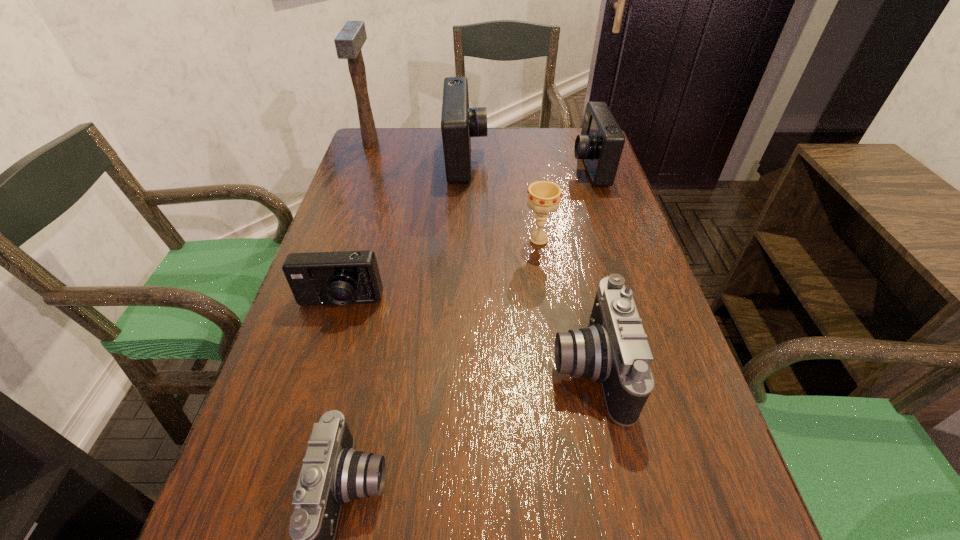
In order to click on the tallest object in this screenshot , I will do `click(351, 38)`.

Locate an element on the screen. the fourth object from right to left is located at coordinates (459, 123).

Image resolution: width=960 pixels, height=540 pixels. I want to click on the second blue camera from left to right, so click(459, 123).

At what (x,y) coordinates should I click in order to perform the action: click on the rightmost blue camera. Please return your answer as a coordinate pair (x, y). The image size is (960, 540). Looking at the image, I should click on (600, 145).

At what (x,y) coordinates should I click in order to perform the action: click on the rightmost object. Please return your answer as a coordinate pair (x, y). The height and width of the screenshot is (540, 960). Looking at the image, I should click on (600, 145).

The image size is (960, 540). What are the coordinates of `the right black camera` in the screenshot? It's located at coord(614,351).

Where is `the second nearest camera`? This screenshot has height=540, width=960. the second nearest camera is located at coordinates tap(614, 351).

The image size is (960, 540). What are the coordinates of `chalice` in the screenshot? It's located at (543, 196).

This screenshot has height=540, width=960. Identify the location of the leftmost blue camera. (343, 277).

This screenshot has width=960, height=540. Identify the location of the nearest blue camera. (343, 277).